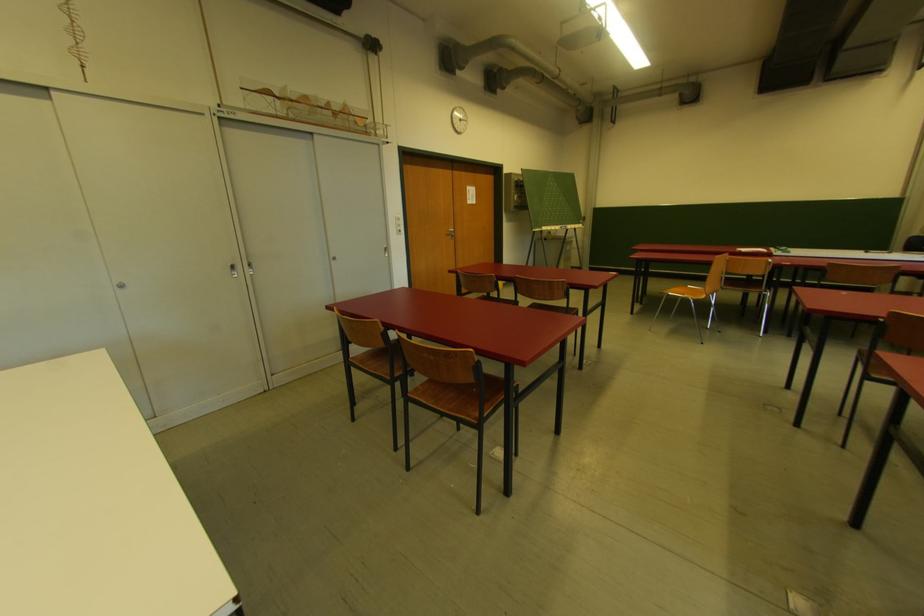
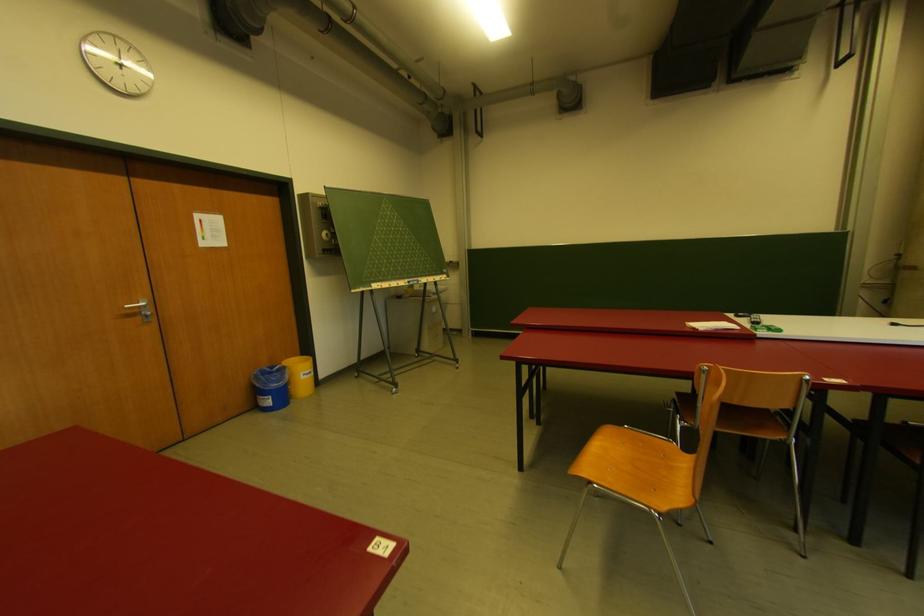
Where in the second image is the point corresponding to point 496,94 from the first image?

(246, 43)